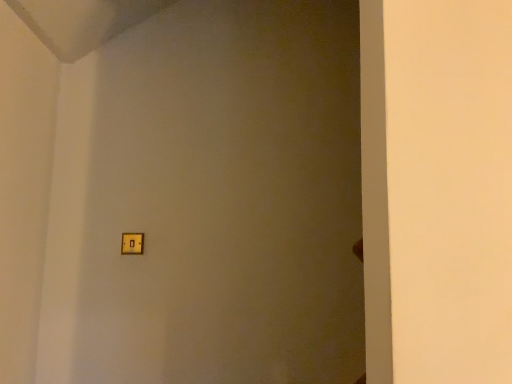
The height and width of the screenshot is (384, 512). What do you see at coordinates (132, 243) in the screenshot? I see `gold metallic light switch at lower left` at bounding box center [132, 243].

Where is `gold metallic light switch at lower left`? gold metallic light switch at lower left is located at coordinates (132, 243).

Where is `gold metallic light switch at lower left`? The width and height of the screenshot is (512, 384). gold metallic light switch at lower left is located at coordinates (132, 243).